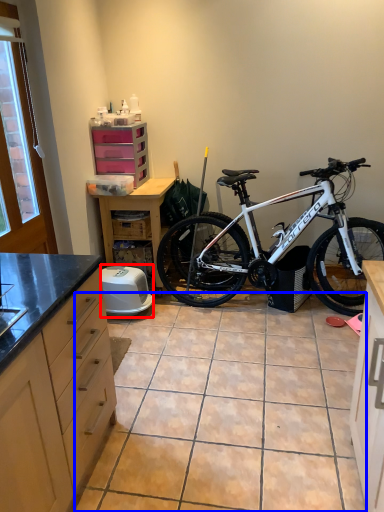
Question: Among these objects, which one is farthest to the camera, appliance (highlighted by a red box) or tile (highlighted by a blue box)?

Choices:
 (A) appliance
 (B) tile

Answer: (A)